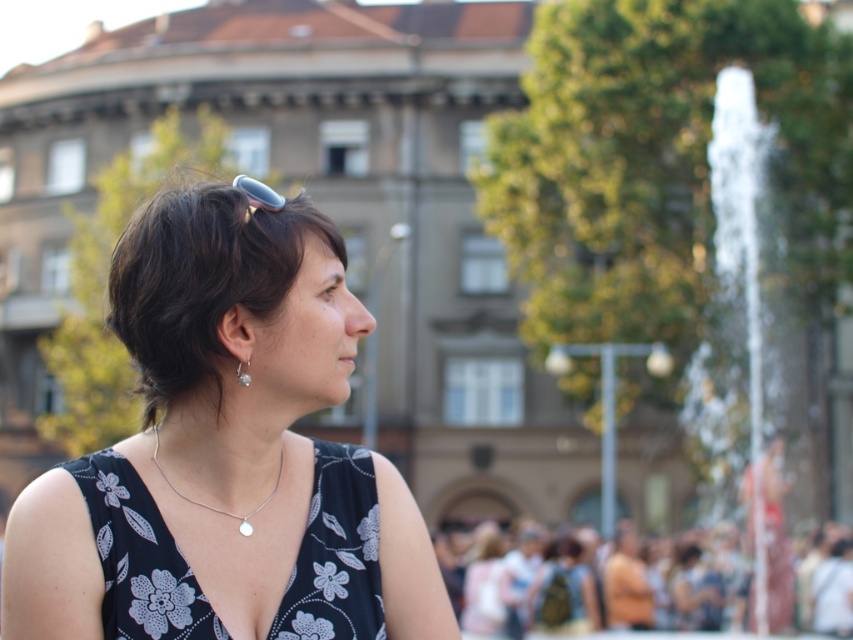
Question: Does black floral dress at center have a smaller size compared to white frothy water at right?

Choices:
 (A) no
 (B) yes

Answer: (B)

Question: Which object is positioned farthest from the black floral dress at center?

Choices:
 (A) silver metallic necklace at center
 (B) white frothy water at right

Answer: (B)

Question: Is black floral fabric dress at center further to the viewer compared to white frothy water at right?

Choices:
 (A) yes
 (B) no

Answer: (B)

Question: Is black floral fabric dress at center behind white frothy water at right?

Choices:
 (A) yes
 (B) no

Answer: (B)

Question: Which point appears farthest from the camera in this image?

Choices:
 (A) (218, 458)
 (B) (753, 444)

Answer: (B)

Question: Based on their relative distances, which object is farther from the blurred crowd at lower right?

Choices:
 (A) silver metallic earring at lower left
 (B) black floral fabric dress at center
 (C) black floral dress at center
 (D) dark brown hair at center

Answer: (A)